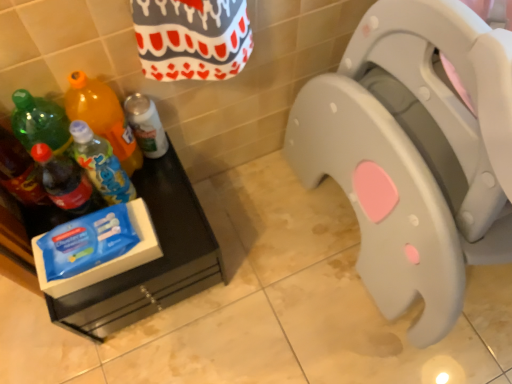
Find the location of `vacant area that lies in front of white matte spray can at lower left, the first bottle positioned from the right`. vacant area that lies in front of white matte spray can at lower left, the first bottle positioned from the right is located at coordinates pos(170,206).